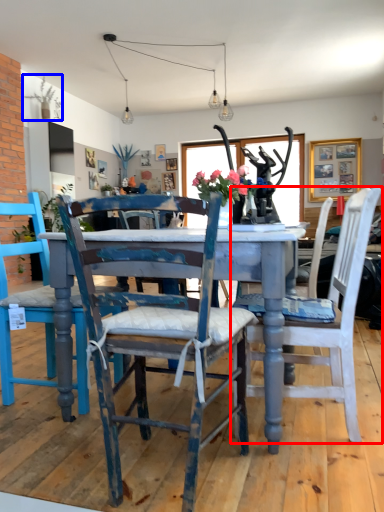
Question: Which object is further to the camera taking this photo, chair (highlighted by a red box) or plant (highlighted by a blue box)?

Choices:
 (A) chair
 (B) plant

Answer: (B)